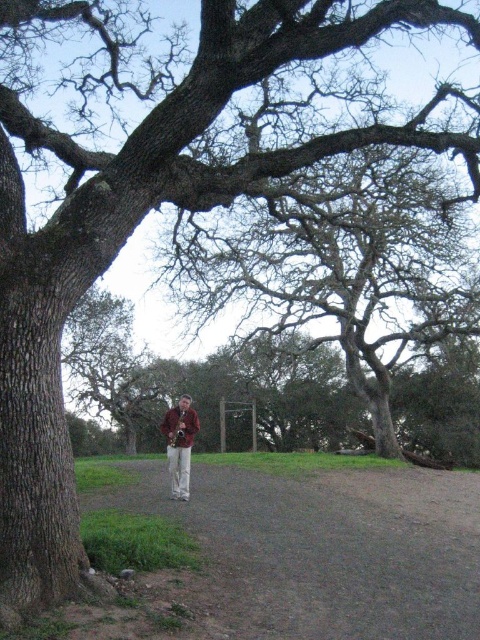
Question: Considering the relative positions of brown gravel path at center and brown leather jacket at center in the image provided, where is brown gravel path at center located with respect to brown leather jacket at center?

Choices:
 (A) left
 (B) right

Answer: (B)

Question: Does brown gravel path at center appear on the right side of brown leather jacket at center?

Choices:
 (A) no
 (B) yes

Answer: (B)

Question: Among these points, which one is nearest to the camera?

Choices:
 (A) (335, 612)
 (B) (180, 432)

Answer: (A)

Question: Is brown gravel path at center closer to the viewer compared to brown leather jacket at center?

Choices:
 (A) yes
 (B) no

Answer: (A)

Question: Which of the following is the farthest from the observer?

Choices:
 (A) brown gravel path at center
 (B) brown leather jacket at center

Answer: (B)